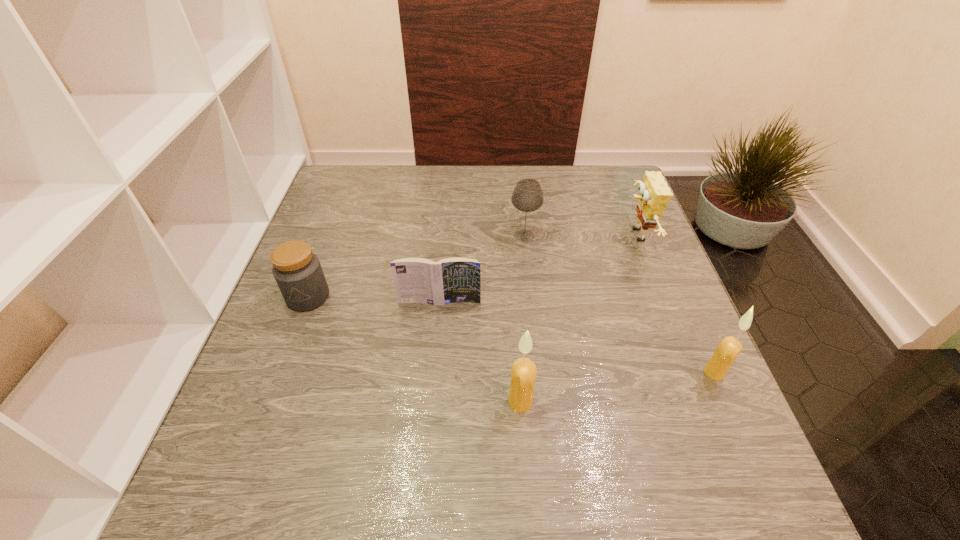
You are a GUI agent. You are given a task and a screenshot of the screen. Output one action in this format:
    pyautogui.click(x=<x>, y=<y>)
    Task: Click on the free space that is in between the jar and the fifth farthest object
    This screenshot has width=960, height=540.
    Given the screenshot: What is the action you would take?
    pyautogui.click(x=511, y=334)

What are the coordinates of `free space between the sponge and the nearer candle` in the screenshot? It's located at (578, 319).

The image size is (960, 540). What are the coordinates of `vacant area between the wineglass and the nearer candle` in the screenshot? It's located at (522, 319).

Locate an element on the screen. vacant region between the book and the right candle is located at coordinates (577, 337).

The width and height of the screenshot is (960, 540). I want to click on free spot between the farther candle and the taller candle, so click(617, 387).

Identify which object is the second nearest to the leftmost object. Please provide its 2D coordinates. Your answer should be formatted as a tuple, i.e. [(x, y)], where the tuple contains the x and y coordinates of a point satisfying the conditions above.

[(527, 196)]

Select which object appears as the third closest to the wineglass. Please provide its 2D coordinates. Your answer should be formatted as a tuple, i.e. [(x, y)], where the tuple contains the x and y coordinates of a point satisfying the conditions above.

[(523, 374)]

Identify the location of vacant space that satisfies the following two spatial constraints: 1. on the face of the sponge; 2. on the front cover of the second object from left to right. The height and width of the screenshot is (540, 960). (661, 302).

The height and width of the screenshot is (540, 960). I want to click on free spot that satisfies the following two spatial constraints: 1. on the front cover of the book; 2. on the left side of the tallest object, so click(x=431, y=402).

Image resolution: width=960 pixels, height=540 pixels. Find the location of `vacant region that satisfies the following two spatial constraints: 1. on the face of the sponge; 2. on the surface of the leftmost object near the warning symbol`. vacant region that satisfies the following two spatial constraints: 1. on the face of the sponge; 2. on the surface of the leftmost object near the warning symbol is located at coordinates click(660, 296).